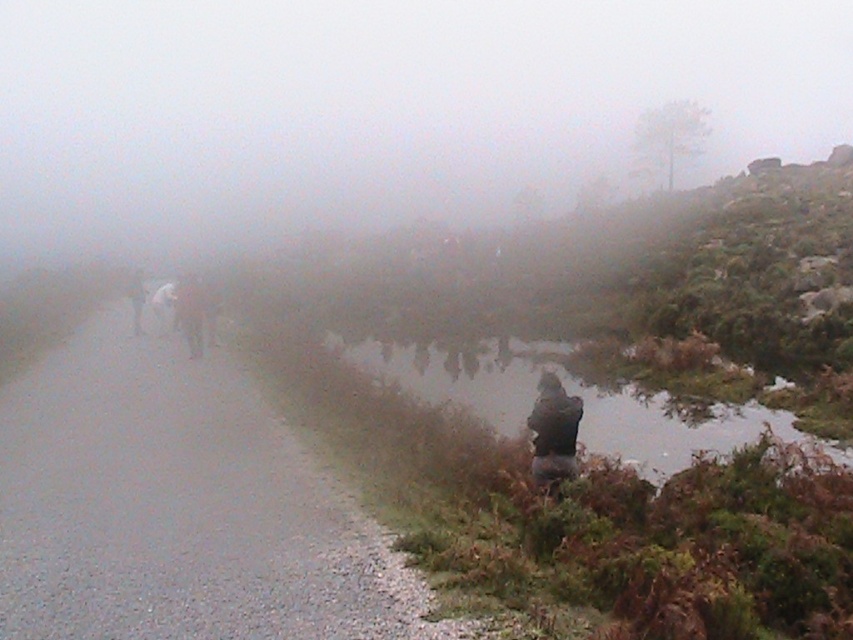
You are a hiker carrying a white fabric jacket at left and need to walk along the gray gravel road at left. Will the road be wide enough for you to walk comfortably while holding the jacket?

The gray gravel road at left is narrower than the white fabric jacket at left, so the road may not be wide enough for comfortable walking while holding the jacket.

You are standing at the center of the image and want to walk along the gray gravel road at left. In which direction should you move relative to your current position?

The gray gravel road at left is located at coordinates point (177, 508), so you should move towards the left direction to reach it.